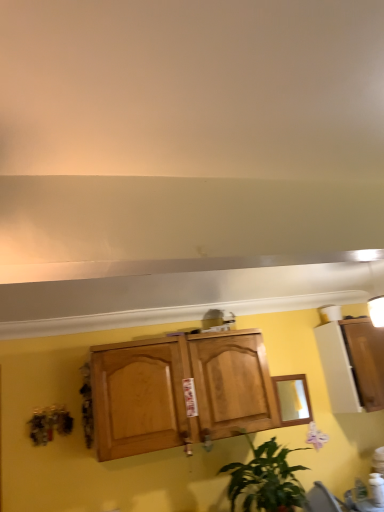
Question: Is matte brown chair at lower right located within white glossy cabinet at right?

Choices:
 (A) no
 (B) yes

Answer: (A)

Question: From a real-world perspective, is white glossy cabinet at right physically above matte brown chair at lower right?

Choices:
 (A) no
 (B) yes

Answer: (B)

Question: Is the depth of white glossy cabinet at right greater than that of matte brown chair at lower right?

Choices:
 (A) yes
 (B) no

Answer: (A)

Question: Considering the relative sizes of white glossy cabinet at right and matte brown chair at lower right in the image provided, is white glossy cabinet at right smaller than matte brown chair at lower right?

Choices:
 (A) no
 (B) yes

Answer: (A)

Question: Considering the relative positions of white glossy cabinet at right and matte brown chair at lower right in the image provided, is white glossy cabinet at right in front of matte brown chair at lower right?

Choices:
 (A) no
 (B) yes

Answer: (A)

Question: Is white glossy cabinet at right to the left of matte brown chair at lower right from the viewer's perspective?

Choices:
 (A) no
 (B) yes

Answer: (A)

Question: Could you tell me if wooden mirror at center is turned towards white glossy cabinet at right?

Choices:
 (A) yes
 (B) no

Answer: (B)

Question: Is wooden mirror at center behind white glossy cabinet at right?

Choices:
 (A) no
 (B) yes

Answer: (B)

Question: Would you say wooden mirror at center is outside white glossy cabinet at right?

Choices:
 (A) no
 (B) yes

Answer: (B)

Question: Is wooden mirror at center smaller than white glossy cabinet at right?

Choices:
 (A) no
 (B) yes

Answer: (B)

Question: Is wooden mirror at center at the right side of white glossy cabinet at right?

Choices:
 (A) no
 (B) yes

Answer: (A)

Question: Considering the relative sizes of wooden mirror at center and white glossy cabinet at right in the image provided, is wooden mirror at center shorter than white glossy cabinet at right?

Choices:
 (A) no
 (B) yes

Answer: (B)

Question: Is the depth of wooden mirror at center less than that of green leafy plant at lower center?

Choices:
 (A) no
 (B) yes

Answer: (A)